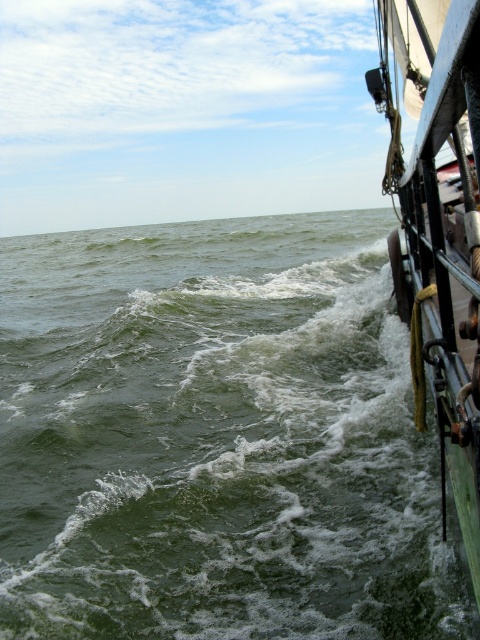
Question: In this image, where is green frothy water at lower left located relative to green matte sailboat at right?

Choices:
 (A) left
 (B) right

Answer: (A)

Question: From the image, what is the correct spatial relationship of green frothy water at lower left in relation to green matte sailboat at right?

Choices:
 (A) right
 (B) left

Answer: (B)

Question: Which of the following is the closest to the observer?

Choices:
 (A) green matte sailboat at right
 (B) green frothy water at lower left

Answer: (A)

Question: Which point appears farthest from the camera in this image?

Choices:
 (A) (143, 230)
 (B) (464, 100)

Answer: (A)

Question: Can you confirm if green frothy water at lower left is positioned to the right of green matte sailboat at right?

Choices:
 (A) no
 (B) yes

Answer: (A)